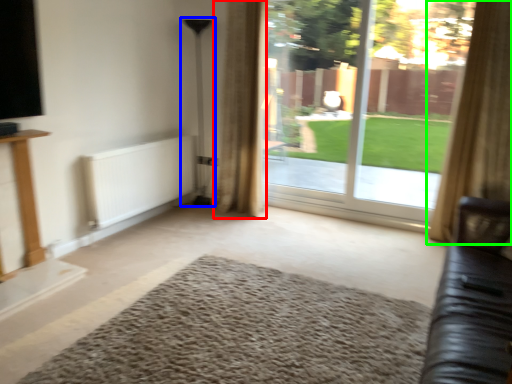
Question: Based on their relative distances, which object is farther from curtain (highlighted by a red box)? Choose from lamp (highlighted by a blue box) and curtain (highlighted by a green box).

Choices:
 (A) lamp
 (B) curtain

Answer: (B)